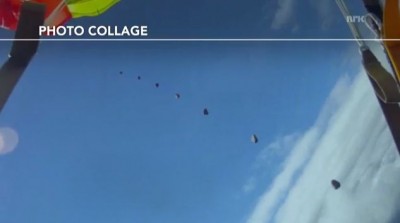
At what (x,y) coordinates should I click in order to perform the action: click on photo collage. Please return your answer as a coordinate pair (x, y). The image size is (400, 223). Looking at the image, I should click on (45, 30).